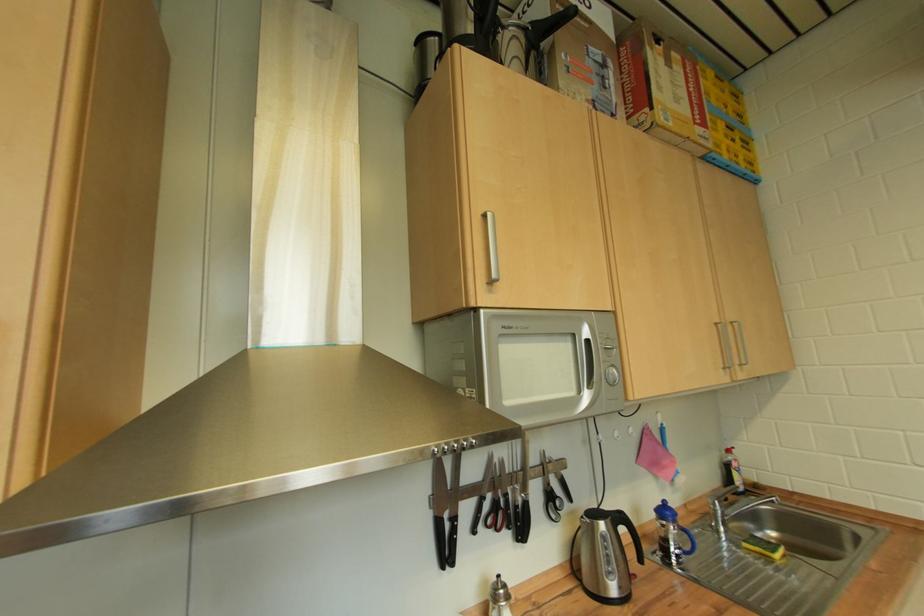
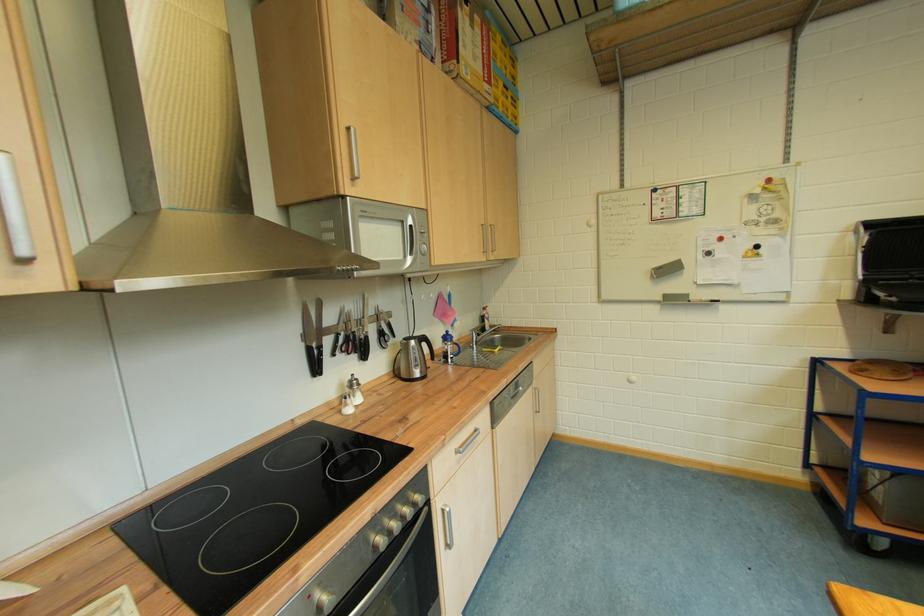
The point at (445, 525) is marked in the first image. Where is the corresponding point in the second image?

(317, 352)